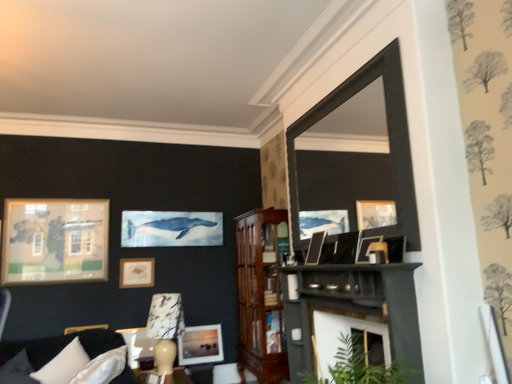
Question: Can you confirm if matte gold picture frame at upper left, which appears as the fourth picture frame when viewed from the top, is wider than dark gray fabric couch at lower left?

Choices:
 (A) yes
 (B) no

Answer: (B)

Question: From the image's perspective, is matte gold picture frame at upper left, which is counted as the fifth picture frame, starting from the front, under dark gray fabric couch at lower left?

Choices:
 (A) no
 (B) yes

Answer: (A)

Question: From a real-world perspective, is matte gold picture frame at upper left, the 2th picture frame from the bottom, on top of dark gray fabric couch at lower left?

Choices:
 (A) no
 (B) yes

Answer: (B)

Question: Can you confirm if matte gold picture frame at upper left, the 2th picture frame from the bottom, is smaller than dark gray fabric couch at lower left?

Choices:
 (A) no
 (B) yes

Answer: (B)

Question: From the image's perspective, does matte gold picture frame at upper left, the 2th picture frame from the bottom, appear higher than dark gray fabric couch at lower left?

Choices:
 (A) no
 (B) yes

Answer: (B)

Question: Is matte glass picture frame at center, the second picture frame positioned from the left, taller or shorter than matte black picture frame at center, the third picture frame positioned from the right?

Choices:
 (A) tall
 (B) short

Answer: (A)

Question: Is matte glass picture frame at center, which is the fifth picture frame from top to bottom, inside the boundaries of matte black picture frame at center, which appears as the third picture frame when viewed from the back, or outside?

Choices:
 (A) inside
 (B) outside

Answer: (B)

Question: From a real-world perspective, relative to matte black picture frame at center, acting as the third picture frame starting from the top, is matte glass picture frame at center, acting as the 4th picture frame starting from the right, vertically above or below?

Choices:
 (A) below
 (B) above

Answer: (A)

Question: Does point (221, 357) appear closer or farther from the camera than point (316, 261)?

Choices:
 (A) farther
 (B) closer

Answer: (A)

Question: Considering the positions of point [x=274, y=342] and point [x=352, y=251], is point [x=274, y=342] closer or farther from the camera than point [x=352, y=251]?

Choices:
 (A) closer
 (B) farther

Answer: (B)

Question: Considering their positions, is mahogany wood cabinet at center located in front of or behind matte black picture frame at center, the 2th picture frame from the top?

Choices:
 (A) behind
 (B) front

Answer: (A)

Question: Considering the positions of mahogany wood cabinet at center and matte black picture frame at center, the 2th picture frame from the top, in the image, is mahogany wood cabinet at center taller or shorter than matte black picture frame at center, the 2th picture frame from the top,?

Choices:
 (A) tall
 (B) short

Answer: (A)

Question: Would you say mahogany wood cabinet at center is inside or outside matte black picture frame at center, positioned as the second picture frame in right-to-left order?

Choices:
 (A) inside
 (B) outside

Answer: (B)

Question: In the image, is smooth dark wood shelf at center positioned in front of or behind matte gold picture frame at upper left, the 2th picture frame from the bottom?

Choices:
 (A) behind
 (B) front

Answer: (B)

Question: Considering the positions of smooth dark wood shelf at center and matte gold picture frame at upper left, the 5th picture frame viewed from the right, in the image, is smooth dark wood shelf at center bigger or smaller than matte gold picture frame at upper left, the 5th picture frame viewed from the right,?

Choices:
 (A) big
 (B) small

Answer: (A)